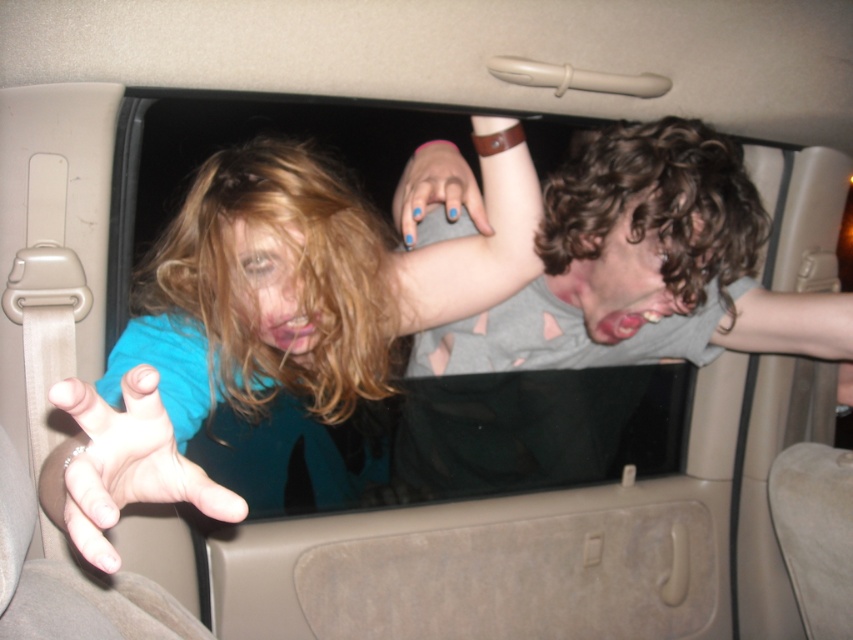
You are a GUI agent. You are given a task and a screenshot of the screen. Output one action in this format:
    pyautogui.click(x=<x>, y=<y>)
    Task: Click on the gray matte shirt at upper right
    
    Given the screenshot: What is the action you would take?
    pyautogui.click(x=643, y=266)

At what (x,y) coordinates should I click in order to perform the action: click on gray matte shirt at upper right. Please return your answer as a coordinate pair (x, y). This screenshot has height=640, width=853. Looking at the image, I should click on (643, 266).

Does point (409, 301) lie in front of point (421, 150)?

Yes, point (409, 301) is in front of point (421, 150).

Is point (73, 483) positioned before point (467, 186)?

That is True.

Identify the location of blue matte shirt at left. The width and height of the screenshot is (853, 640). (120, 465).

The image size is (853, 640). What do you see at coordinates (120, 465) in the screenshot?
I see `light blue fabric hand at center` at bounding box center [120, 465].

Who is more distant from viewer, (167, 419) or (424, 212)?

The point (424, 212) is behind.

Which is behind, point (181, 499) or point (467, 164)?

Positioned behind is point (467, 164).

The image size is (853, 640). Find the location of `light blue fabric hand at center`. light blue fabric hand at center is located at coordinates (120, 465).